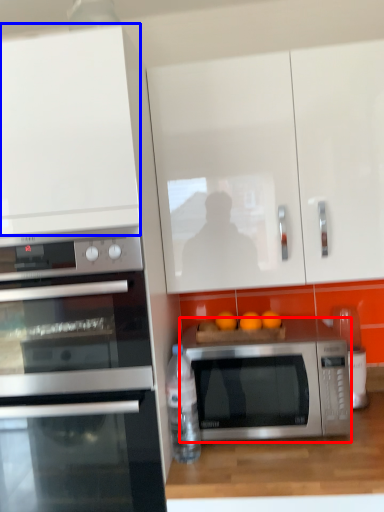
Question: Which object is further to the camera taking this photo, microwave oven (highlighted by a red box) or cabinetry (highlighted by a blue box)?

Choices:
 (A) microwave oven
 (B) cabinetry

Answer: (A)